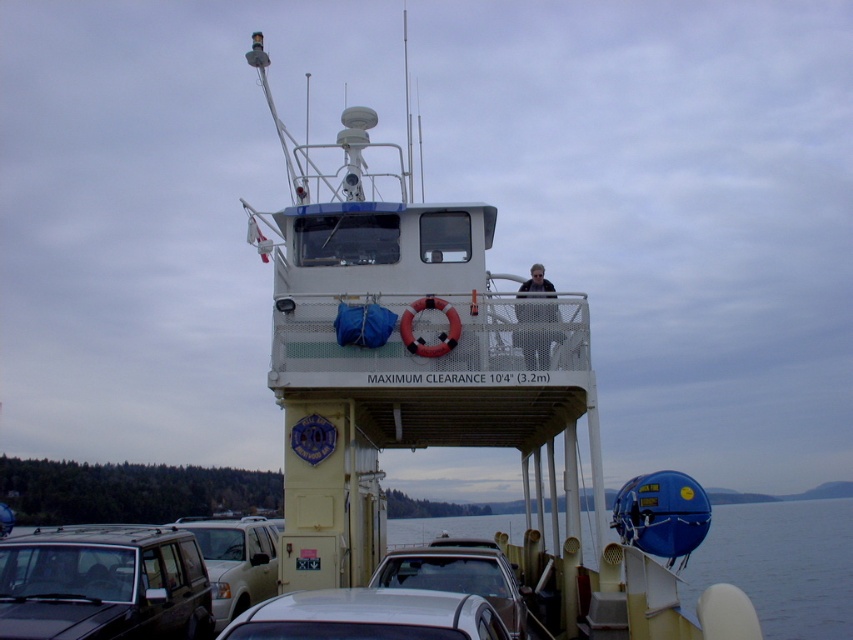
Question: Which point is farther to the camera?

Choices:
 (A) (547, 353)
 (B) (288, 419)

Answer: (B)

Question: Which point appears closest to the camera in this image?

Choices:
 (A) (428, 586)
 (B) (486, 337)

Answer: (A)

Question: Which point is closer to the camera?

Choices:
 (A) (524, 384)
 (B) (242, 548)
 (C) (538, 273)

Answer: (A)

Question: Can you confirm if white matte boat at center is thinner than metallic silver suv at lower left?

Choices:
 (A) yes
 (B) no

Answer: (B)

Question: Does matte black suv at lower left have a larger size compared to silver metallic car at lower center?

Choices:
 (A) no
 (B) yes

Answer: (B)

Question: Is white matte boat at center to the left of dark gray mesh jacket at upper center from the viewer's perspective?

Choices:
 (A) no
 (B) yes

Answer: (B)